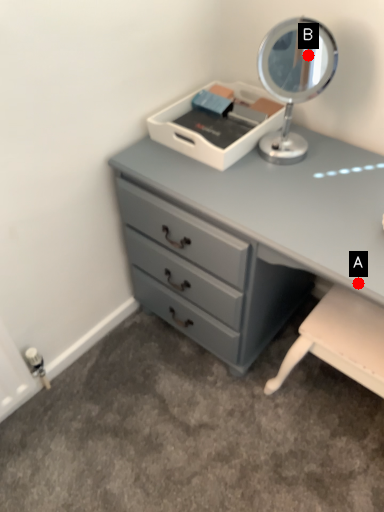
Question: Two points are circled on the image, labeled by A and B beside each circle. Among these points, which one is nearest to the camera?

Choices:
 (A) A is closer
 (B) B is closer

Answer: (A)